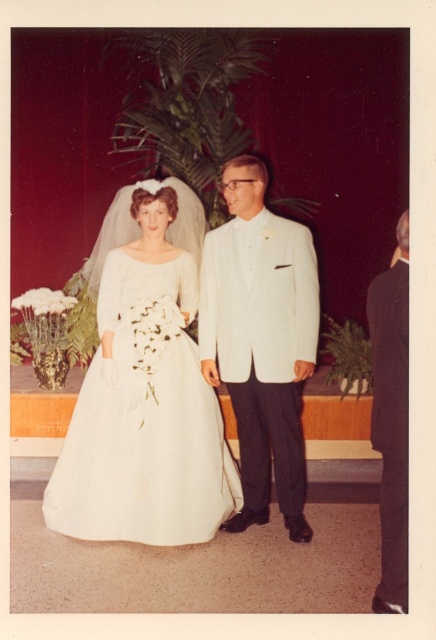
You are a photographer planning to capture a group photo of the bride in the white satin dress at center and the groom in the black satin suit at right. Considering their attire widths, which one requires more space to the side for a proper composition?

The white satin dress at center requires more space to the side because its width surpasses that of the black satin suit at right.

In the scene shown: You are a photographer at a wedding and need to adjust the lighting to ensure both the white satin dress at center and the black satin suit at right are well lit. Considering their positions, which object should you focus on first to balance the lighting?

The white satin dress at center is located above the black satin suit at right, so you should focus on balancing the lighting for the white satin dress at center first since it is higher and may require more attention to avoid overexposure.

You are a photographer taking a picture of the wedding couple. You have two points marked in the scene, point A at coordinates point (119, 227) and point B at coordinates point (241, 476). Which point is closer to the camera?

Point A at coordinates point (119, 227) is closer to the camera than point B at coordinates point (241, 476).